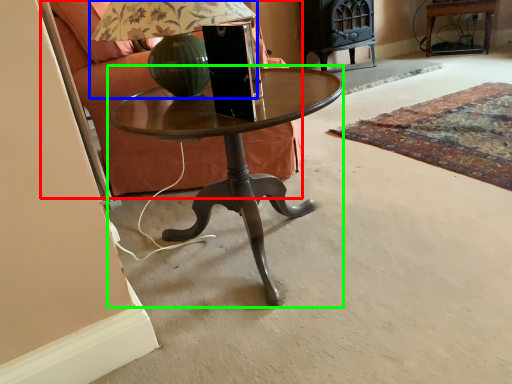
Question: Estimate the real-world distances between objects in this image. Which object is farther from armchair (highlighted by a red box), table lamp (highlighted by a blue box) or coffee table (highlighted by a green box)?

Choices:
 (A) table lamp
 (B) coffee table

Answer: (B)